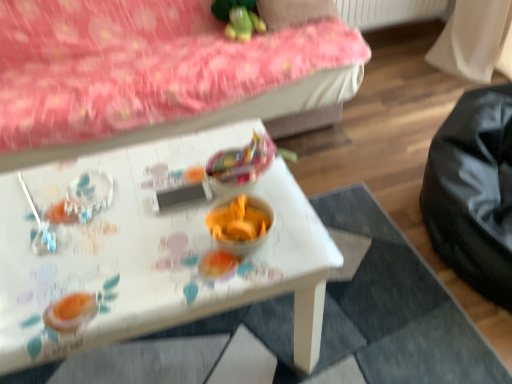
Question: Considering the relative sizes of green plush toy at upper center and pink fabric pillow at upper center in the image provided, is green plush toy at upper center taller than pink fabric pillow at upper center?

Choices:
 (A) no
 (B) yes

Answer: (B)

Question: Considering the relative sizes of green plush toy at upper center and pink fabric pillow at upper center in the image provided, is green plush toy at upper center shorter than pink fabric pillow at upper center?

Choices:
 (A) yes
 (B) no

Answer: (B)

Question: Is green plush toy at upper center outside pink fabric pillow at upper center?

Choices:
 (A) yes
 (B) no

Answer: (A)

Question: Is green plush toy at upper center further to the viewer compared to pink fabric pillow at upper center?

Choices:
 (A) yes
 (B) no

Answer: (B)

Question: Is pink fabric pillow at upper center located within green plush toy at upper center?

Choices:
 (A) yes
 (B) no

Answer: (B)

Question: Does green plush toy at upper center have a lesser width compared to pink fabric pillow at upper center?

Choices:
 (A) no
 (B) yes

Answer: (B)

Question: Can you confirm if pink fabric bed frame at upper left is wider than green plush toy at upper center?

Choices:
 (A) yes
 (B) no

Answer: (A)

Question: Can you confirm if pink fabric bed frame at upper left is bigger than green plush toy at upper center?

Choices:
 (A) yes
 (B) no

Answer: (A)

Question: Can green plush toy at upper center be found inside pink fabric bed frame at upper left?

Choices:
 (A) yes
 (B) no

Answer: (A)

Question: Considering the relative positions of pink fabric bed frame at upper left and green plush toy at upper center in the image provided, is pink fabric bed frame at upper left in front of green plush toy at upper center?

Choices:
 (A) yes
 (B) no

Answer: (A)

Question: Can you confirm if pink fabric bed frame at upper left is smaller than green plush toy at upper center?

Choices:
 (A) yes
 (B) no

Answer: (B)

Question: Could you tell me if pink fabric bed frame at upper left is turned towards green plush toy at upper center?

Choices:
 (A) no
 (B) yes

Answer: (B)

Question: Is pink fabric pillow at upper center not inside white glossy table at center?

Choices:
 (A) no
 (B) yes

Answer: (B)